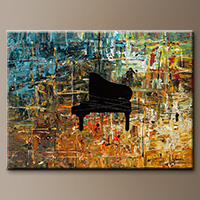
Where is `gallery`? This screenshot has width=200, height=200. gallery is located at coordinates (155, 59).